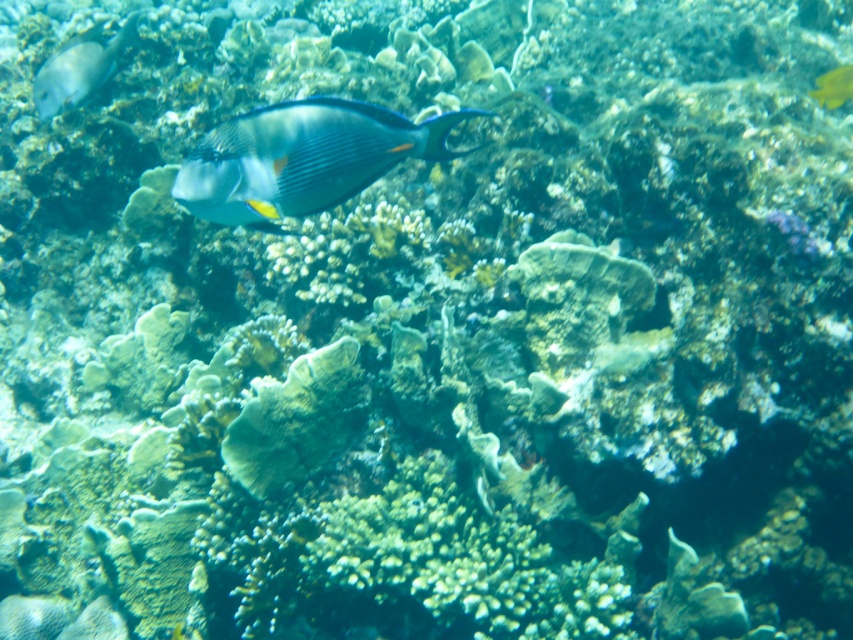
Question: Among these objects, which one is nearest to the camera?

Choices:
 (A) shiny silver fish at upper left
 (B) yellow matte fish at upper right
 (C) blue glossy fish at center

Answer: (C)

Question: Does blue glossy fish at center appear on the left side of shiny silver fish at upper left?

Choices:
 (A) no
 (B) yes

Answer: (A)

Question: Which point is farther from the camera taking this photo?

Choices:
 (A) (51, 65)
 (B) (833, 74)
 (C) (418, 129)

Answer: (A)

Question: Which point appears farthest from the camera in this image?

Choices:
 (A) (837, 88)
 (B) (57, 58)
 (C) (328, 145)

Answer: (B)

Question: Does blue glossy fish at center have a lesser width compared to shiny silver fish at upper left?

Choices:
 (A) yes
 (B) no

Answer: (B)

Question: Does blue glossy fish at center appear on the right side of yellow matte fish at upper right?

Choices:
 (A) no
 (B) yes

Answer: (A)